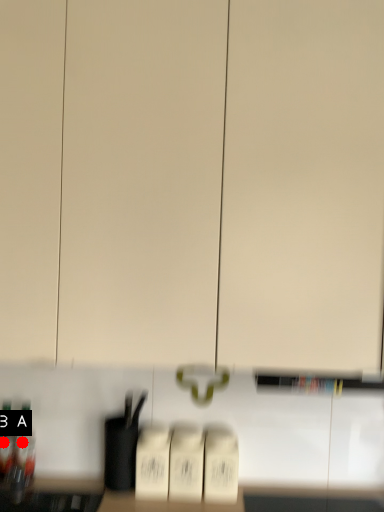
Question: Two points are circled on the image, labeled by A and B beside each circle. Which point is farther from the camera taking this photo?

Choices:
 (A) A is further
 (B) B is further

Answer: (A)